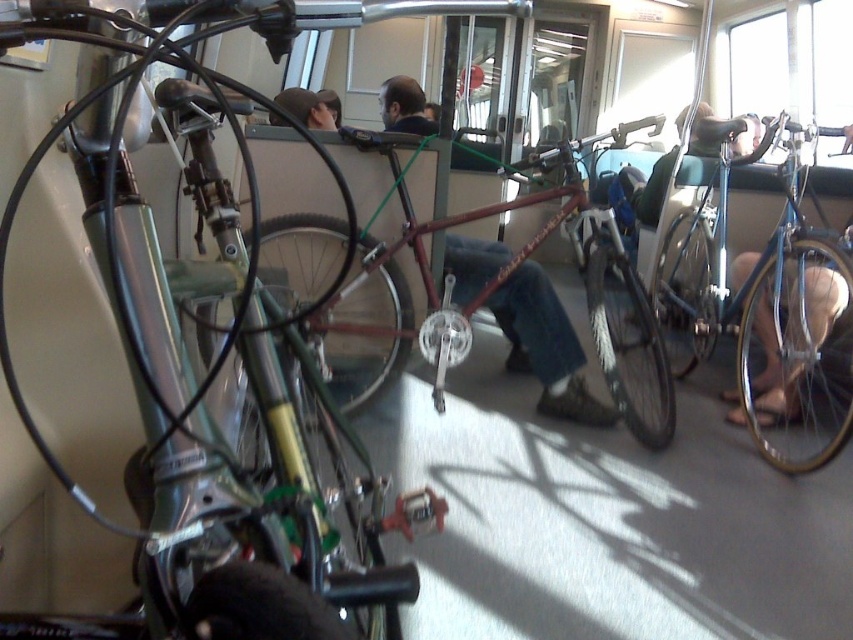
Question: Considering the real-world distances, which object is farthest from the shiny blue bicycle at right?

Choices:
 (A) shiny red bike at center
 (B) shiny metallic bicycle at center

Answer: (B)

Question: In this image, where is shiny metallic bicycle at center located relative to shiny red bike at center?

Choices:
 (A) left
 (B) right

Answer: (A)

Question: Which object appears farthest from the camera in this image?

Choices:
 (A) shiny red bike at center
 (B) shiny blue bicycle at right

Answer: (B)

Question: Can you confirm if shiny metallic bicycle at center is smaller than shiny red bike at center?

Choices:
 (A) no
 (B) yes

Answer: (B)

Question: Does shiny red bike at center appear over shiny blue bicycle at right?

Choices:
 (A) no
 (B) yes

Answer: (B)

Question: Which point is farther from the camera taking this photo?

Choices:
 (A) (752, 291)
 (B) (376, 364)

Answer: (A)